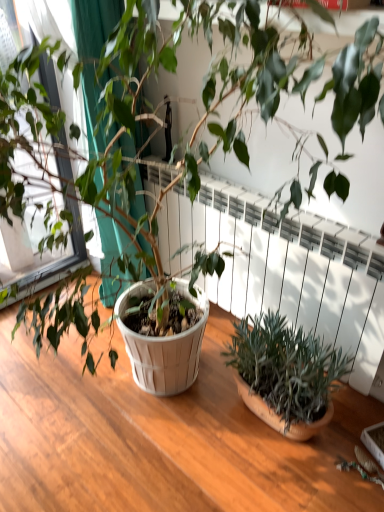
The height and width of the screenshot is (512, 384). Find the location of `vacant position to the left of green matte plant at lower right`. vacant position to the left of green matte plant at lower right is located at coordinates (187, 426).